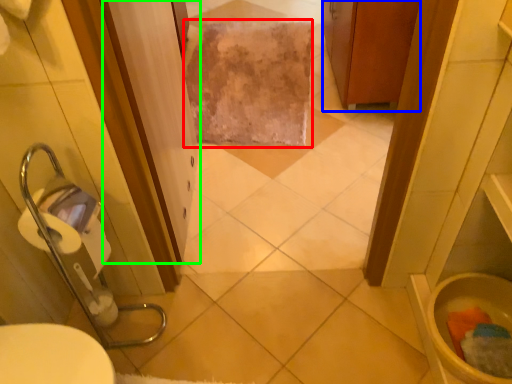
Question: Which is nearer to the bath towel (highlighted by a red box)? cabinetry (highlighted by a blue box) or screen door (highlighted by a green box).

Choices:
 (A) cabinetry
 (B) screen door

Answer: (A)